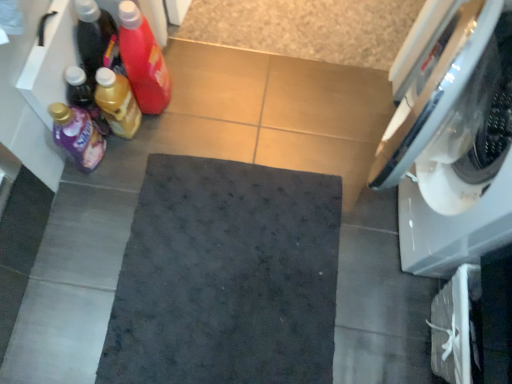
Measure the distance between point (x=90, y=88) and camera.

The depth of point (x=90, y=88) is 4.03 feet.

What are the coordinates of `translucent plastic bottle at left, the 2th bottle from the left` in the screenshot? It's located at (84, 97).

Describe the element at coordinates (117, 103) in the screenshot. I see `translucent plastic bottle at left, the 2th bottle when ordered from right to left` at that location.

What do you see at coordinates (226, 276) in the screenshot?
I see `dark matte bath mat at center` at bounding box center [226, 276].

Locate an element on the screen. This screenshot has width=512, height=384. translucent plastic bottle at left, marked as the fourth bottle in a left-to-right arrangement is located at coordinates (143, 60).

Where is `white glossy washing machine at right`? This screenshot has width=512, height=384. white glossy washing machine at right is located at coordinates (449, 141).

Find the location of a particular element. This screenshot has width=512, height=384. translucent plastic bottle at left, the 2th bottle from the left is located at coordinates (84, 97).

Would you say white glossy washing machine at right is to the left or to the right of translucent plastic bottle at left, the 3th bottle when ordered from right to left, in the picture?

white glossy washing machine at right is positioned on translucent plastic bottle at left, the 3th bottle when ordered from right to left,'s right side.

Does white glossy washing machine at right have a greater height compared to translucent plastic bottle at left, the 2th bottle from the left?

Indeed, white glossy washing machine at right has a greater height compared to translucent plastic bottle at left, the 2th bottle from the left.

Considering the sizes of objects white glossy washing machine at right and translucent plastic bottle at left, the 2th bottle from the left, in the image provided, who is bigger, white glossy washing machine at right or translucent plastic bottle at left, the 2th bottle from the left,?

white glossy washing machine at right is bigger.

The width and height of the screenshot is (512, 384). I want to click on the 3rd bottle above the purple glossy detergent at left, marked as the 4th bottle in a right-to-left arrangement (from the image's perspective), so click(143, 60).

In terms of width, does purple glossy detergent at left, marked as the 4th bottle in a right-to-left arrangement, look wider or thinner when compared to translucent plastic bottle at left, positioned as the 1th bottle in right-to-left order?

purple glossy detergent at left, marked as the 4th bottle in a right-to-left arrangement, is thinner than translucent plastic bottle at left, positioned as the 1th bottle in right-to-left order.

From a real-world perspective, is purple glossy detergent at left, marked as the 4th bottle in a right-to-left arrangement, located beneath translucent plastic bottle at left, positioned as the 1th bottle in right-to-left order?

Yes, from a real-world perspective, purple glossy detergent at left, marked as the 4th bottle in a right-to-left arrangement, is below translucent plastic bottle at left, positioned as the 1th bottle in right-to-left order.

Is point (62, 146) behind point (164, 62)?

No, it is not.

In the scene shown: Is the position of white glossy washing machine at right more distant than that of dark matte bath mat at center?

No, white glossy washing machine at right is closer to the camera.

Considering the positions of point (440, 34) and point (258, 365), is point (440, 34) closer or farther from the camera than point (258, 365)?

Clearly, point (440, 34) is closer to the camera than point (258, 365).

At what (x,y) coordinates should I click in order to perform the action: click on bath mat that appears on the left of white glossy washing machine at right. Please return your answer as a coordinate pair (x, y). Looking at the image, I should click on (226, 276).

Is white glossy washing machine at right next to dark matte bath mat at center and touching it?

No, white glossy washing machine at right is not beside dark matte bath mat at center.

Is dark matte bath mat at center turned away from translucent plastic bottle at left, positioned as the 1th bottle in right-to-left order?

No, dark matte bath mat at center is not facing away from translucent plastic bottle at left, positioned as the 1th bottle in right-to-left order.

Which object is more forward, dark matte bath mat at center or translucent plastic bottle at left, positioned as the 1th bottle in right-to-left order?

Positioned in front is translucent plastic bottle at left, positioned as the 1th bottle in right-to-left order.

Is dark matte bath mat at center taller than translucent plastic bottle at left, marked as the fourth bottle in a left-to-right arrangement?

Incorrect, the height of dark matte bath mat at center is not larger of that of translucent plastic bottle at left, marked as the fourth bottle in a left-to-right arrangement.

Is dark matte bath mat at center wider than translucent plastic bottle at left, marked as the fourth bottle in a left-to-right arrangement?

Indeed, dark matte bath mat at center has a greater width compared to translucent plastic bottle at left, marked as the fourth bottle in a left-to-right arrangement.

From a real-world perspective, which object stands above the other?

white glossy washing machine at right is physically above.

The height and width of the screenshot is (384, 512). Find the location of `the 4th bottle behind the white glossy washing machine at right, counting from the anchor's position`. the 4th bottle behind the white glossy washing machine at right, counting from the anchor's position is located at coordinates coord(84,97).

Would you say white glossy washing machine at right is part of translucent plastic bottle at left, the 3th bottle when ordered from right to left,'s contents?

Definitely not — white glossy washing machine at right is not inside translucent plastic bottle at left, the 3th bottle when ordered from right to left.

Can you see translucent plastic bottle at left, the 2th bottle from the left, touching white glossy washing machine at right?

translucent plastic bottle at left, the 2th bottle from the left, and white glossy washing machine at right are clearly separated.

Find the location of a particular element. the 4th bottle to the left of the dark matte bath mat at center, counting from the anchor's position is located at coordinates (77, 135).

How much distance is there between purple glossy detergent at left, arranged as the 1th bottle when viewed from the left, and dark matte bath mat at center?

They are 19.51 inches apart.

From the image's perspective, is purple glossy detergent at left, arranged as the 1th bottle when viewed from the left, above or below dark matte bath mat at center?

purple glossy detergent at left, arranged as the 1th bottle when viewed from the left, is situated higher than dark matte bath mat at center in the image.

Considering the relative sizes of purple glossy detergent at left, arranged as the 1th bottle when viewed from the left, and dark matte bath mat at center in the image provided, is purple glossy detergent at left, arranged as the 1th bottle when viewed from the left, shorter than dark matte bath mat at center?

No.

Is dark matte bath mat at center next to translucent plastic bottle at left, the 2th bottle from the left, and touching it?

No.

From the image's perspective, which one is positioned lower, dark matte bath mat at center or translucent plastic bottle at left, the 3th bottle when ordered from right to left?

From the image's view, dark matte bath mat at center is below.

Is translucent plastic bottle at left, the 2th bottle from the left, located within dark matte bath mat at center?

No, translucent plastic bottle at left, the 2th bottle from the left, is not inside dark matte bath mat at center.

Identify the location of washing machine on the right of translucent plastic bottle at left, the 2th bottle from the left. (449, 141).

The width and height of the screenshot is (512, 384). I want to click on the 1st bottle behind the translucent plastic bottle at left, marked as the fourth bottle in a left-to-right arrangement, starting your count from the anchor, so click(x=77, y=135).

Based on the photo, when comparing their distances from translucent plastic bottle at left, positioned as the 1th bottle in right-to-left order, does dark matte bath mat at center or translucent plastic bottle at left, the 2th bottle when ordered from right to left, seem closer?

translucent plastic bottle at left, the 2th bottle when ordered from right to left, is closer to translucent plastic bottle at left, positioned as the 1th bottle in right-to-left order.

Which object lies nearer to the anchor point translucent plastic bottle at left, marked as the fourth bottle in a left-to-right arrangement, white glossy washing machine at right or dark matte bath mat at center?

dark matte bath mat at center is closer to translucent plastic bottle at left, marked as the fourth bottle in a left-to-right arrangement.

Estimate the real-world distances between objects in this image. Which object is further from white glossy washing machine at right, translucent plastic bottle at left, positioned as the 1th bottle in right-to-left order, or translucent plastic bottle at left, the 3th bottle when ordered from right to left?

Based on the image, translucent plastic bottle at left, the 3th bottle when ordered from right to left, appears to be further to white glossy washing machine at right.

Estimate the real-world distances between objects in this image. Which object is closer to purple glossy detergent at left, marked as the 4th bottle in a right-to-left arrangement, translucent plastic bottle at left, marked as the fourth bottle in a left-to-right arrangement, or dark matte bath mat at center?

translucent plastic bottle at left, marked as the fourth bottle in a left-to-right arrangement, lies closer to purple glossy detergent at left, marked as the 4th bottle in a right-to-left arrangement, than the other object.

Estimate the real-world distances between objects in this image. Which object is closer to translucent plastic bottle at left, positioned as the 1th bottle in right-to-left order, translucent plastic bottle at left, the 3th bottle when ordered from right to left, or dark matte bath mat at center?

translucent plastic bottle at left, the 3th bottle when ordered from right to left.

Which object lies nearer to the anchor point translucent plastic bottle at left, positioned as the 1th bottle in right-to-left order, purple glossy detergent at left, arranged as the 1th bottle when viewed from the left, or dark matte bath mat at center?

Among the two, purple glossy detergent at left, arranged as the 1th bottle when viewed from the left, is located nearer to translucent plastic bottle at left, positioned as the 1th bottle in right-to-left order.

Based on their spatial positions, is translucent plastic bottle at left, the 3th bottle when ordered from right to left, or dark matte bath mat at center closer to purple glossy detergent at left, arranged as the 1th bottle when viewed from the left?

The object closer to purple glossy detergent at left, arranged as the 1th bottle when viewed from the left, is translucent plastic bottle at left, the 3th bottle when ordered from right to left.

From the image, which object appears to be farther from white glossy washing machine at right, translucent plastic bottle at left, the third bottle when ordered from left to right, or translucent plastic bottle at left, positioned as the 1th bottle in right-to-left order?

translucent plastic bottle at left, the third bottle when ordered from left to right, is positioned further to the anchor white glossy washing machine at right.

Where is `bottle between translucent plastic bottle at left, the 2th bottle when ordered from right to left, and dark matte bath mat at center from top to bottom`? This screenshot has width=512, height=384. bottle between translucent plastic bottle at left, the 2th bottle when ordered from right to left, and dark matte bath mat at center from top to bottom is located at coordinates (77, 135).

Identify the location of bottle between translucent plastic bottle at left, the 3th bottle when ordered from right to left, and translucent plastic bottle at left, marked as the fourth bottle in a left-to-right arrangement, in the horizontal direction. (117, 103).

Find the location of a particular element. Image resolution: width=512 pixels, height=384 pixels. bottle between translucent plastic bottle at left, the 3th bottle when ordered from right to left, and purple glossy detergent at left, marked as the 4th bottle in a right-to-left arrangement, from top to bottom is located at coordinates (117, 103).

Where is `bath mat situated between purple glossy detergent at left, arranged as the 1th bottle when viewed from the left, and white glossy washing machine at right from left to right`? bath mat situated between purple glossy detergent at left, arranged as the 1th bottle when viewed from the left, and white glossy washing machine at right from left to right is located at coordinates (226, 276).